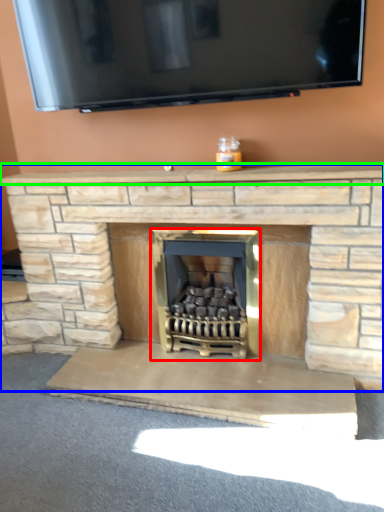
Question: Which object is positioned farthest from wood burning stove (highlighted by a red box)? Select from fireplace (highlighted by a blue box) and mantle (highlighted by a green box).

Choices:
 (A) fireplace
 (B) mantle

Answer: (B)